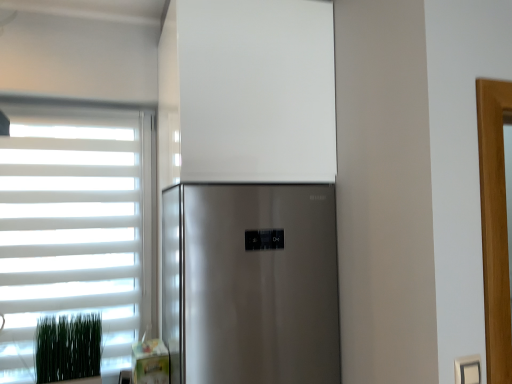
Question: From a real-world perspective, is green grass at lower left above or below satin silver refrigerator at center?

Choices:
 (A) below
 (B) above

Answer: (A)

Question: Based on their positions, is green grass at lower left located to the left or right of satin silver refrigerator at center?

Choices:
 (A) right
 (B) left

Answer: (B)

Question: Which object is positioned closest to the white plastic electric outlet at lower right?

Choices:
 (A) white matte window at left
 (B) green grass at lower left
 (C) satin silver refrigerator at center

Answer: (C)

Question: Estimate the real-world distances between objects in this image. Which object is farther from the green grass at lower left?

Choices:
 (A) white matte window at left
 (B) white plastic electric outlet at lower right
 (C) satin silver refrigerator at center

Answer: (B)